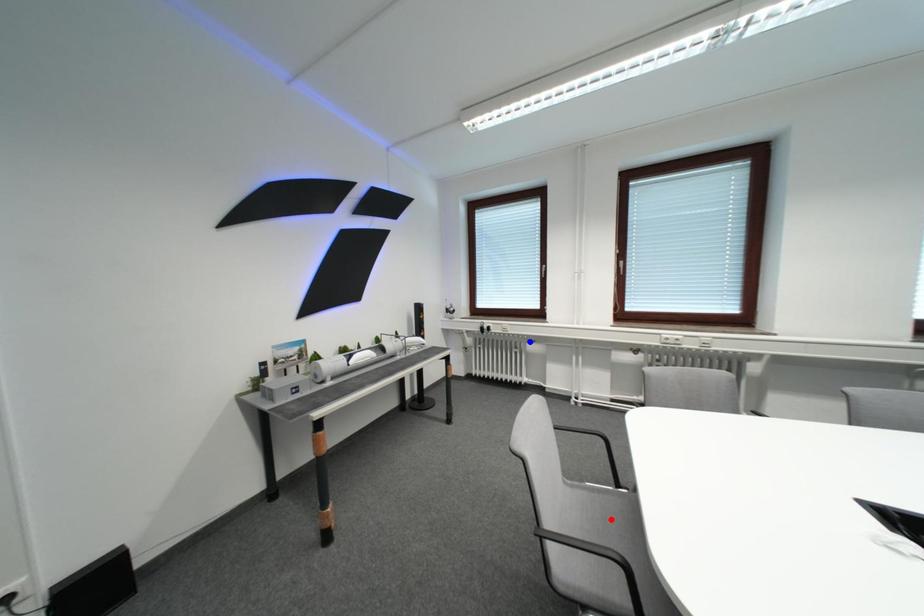
Question: Two points are marked on the image. Which point is closer to the camera?

Choices:
 (A) Blue point is closer.
 (B) Red point is closer.

Answer: (B)